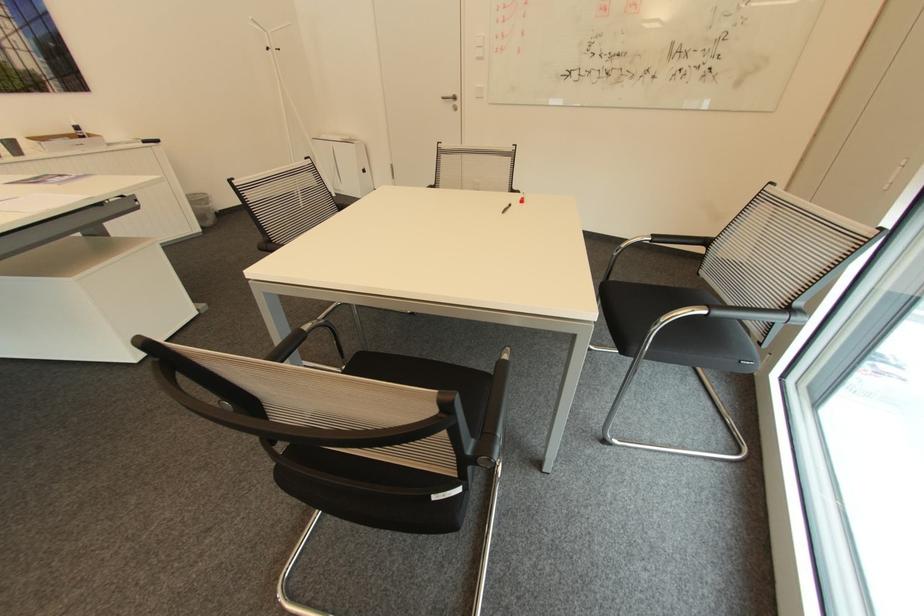
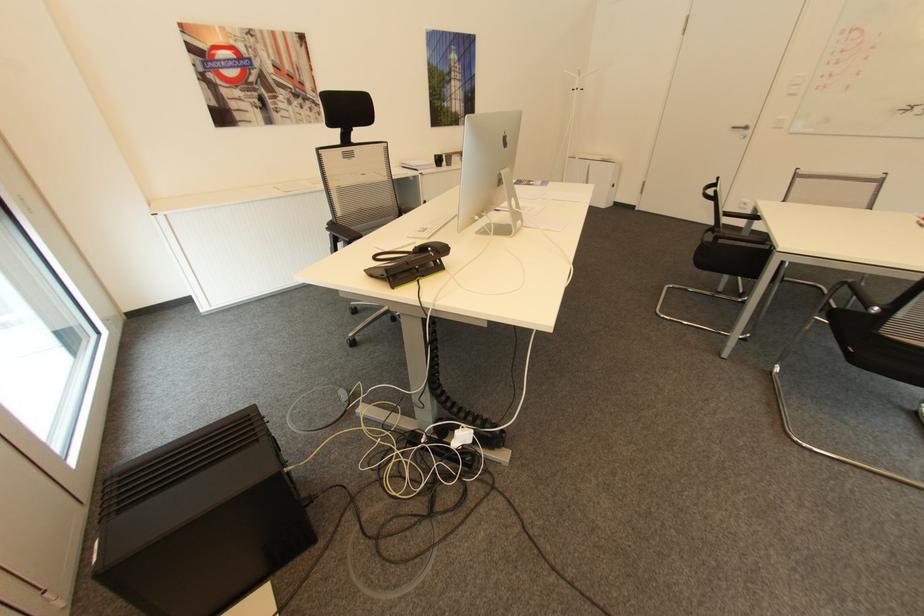
Which direction would the cameraman need to move to produce the second image?

The cameraman moved toward left, backward.